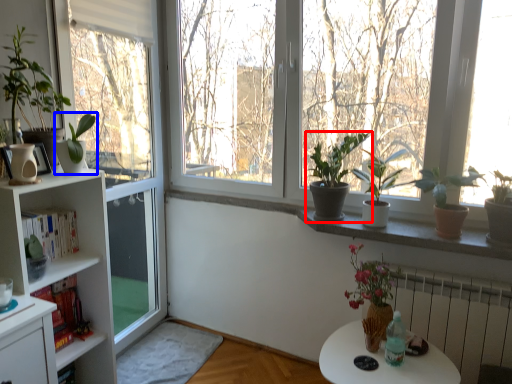
Question: Which object is closer to the camera taking this photo, houseplant (highlighted by a red box) or houseplant (highlighted by a blue box)?

Choices:
 (A) houseplant
 (B) houseplant

Answer: (B)